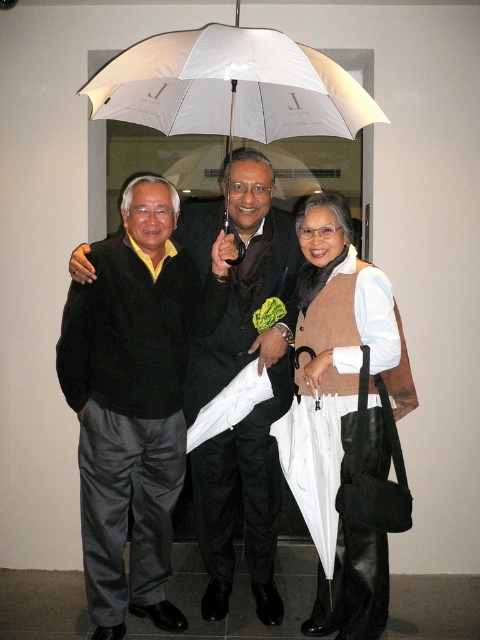
Question: Among these points, which one is nearest to the camera?

Choices:
 (A) (151, 253)
 (B) (347, 80)
 (C) (354, 378)
 (D) (236, 189)

Answer: (B)

Question: Which point is closer to the camera taking this photo?

Choices:
 (A) (225, 289)
 (B) (168, 86)
 (C) (315, 355)
 (D) (217, 595)

Answer: (B)

Question: Does matte black sweater at center have a greater width compared to black satin suit at center?

Choices:
 (A) yes
 (B) no

Answer: (A)

Question: Can you confirm if black satin suit at center is positioned to the left of white matte umbrella at center?

Choices:
 (A) yes
 (B) no

Answer: (A)

Question: Which point is farther to the camera?

Choices:
 (A) (320, 316)
 (B) (224, 65)

Answer: (A)

Question: Where is black satin suit at center located in relation to white matte umbrella at center in the image?

Choices:
 (A) left
 (B) right

Answer: (A)